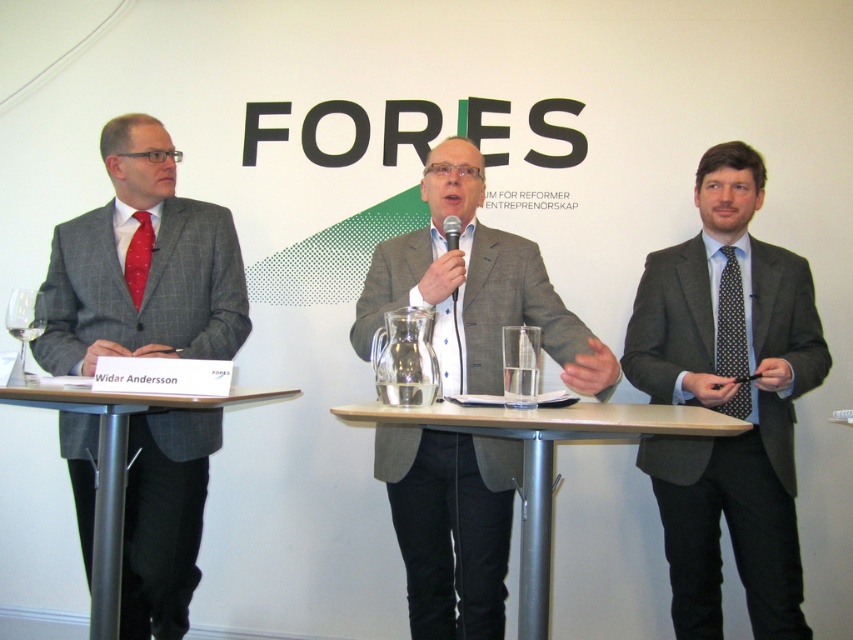
Question: Can you confirm if matte gray suit at left is wider than red dotted tie at left?

Choices:
 (A) yes
 (B) no

Answer: (A)

Question: Considering the relative positions of matte gray suit at right and wooden at center in the image provided, where is matte gray suit at right located with respect to wooden at center?

Choices:
 (A) below
 (B) above

Answer: (B)

Question: Considering the relative positions of wooden table at left and polka dot silk tie at center in the image provided, where is wooden table at left located with respect to polka dot silk tie at center?

Choices:
 (A) below
 (B) above

Answer: (A)

Question: Which object is farther from the camera taking this photo?

Choices:
 (A) matte gray suit at center
 (B) matte gray suit at left

Answer: (B)

Question: Among these objects, which one is farthest from the camera?

Choices:
 (A) matte gray suit at left
 (B) matte gray suit at center
 (C) wooden at center

Answer: (A)

Question: Which of the following is the closest to the observer?

Choices:
 (A) red dotted tie at left
 (B) matte gray suit at right

Answer: (B)